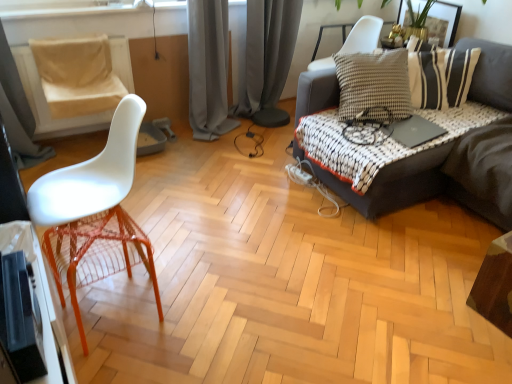
In order to click on vacant space behind wooden table at lower right in this screenshot , I will do `click(457, 263)`.